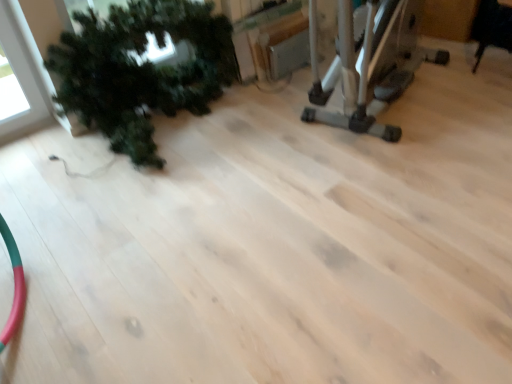
Question: Is black leather chair at upper right smaller than green matte plant at left?

Choices:
 (A) no
 (B) yes

Answer: (B)

Question: Is black leather chair at upper right at the left side of green matte plant at left?

Choices:
 (A) yes
 (B) no

Answer: (B)

Question: Does black leather chair at upper right have a lesser width compared to green matte plant at left?

Choices:
 (A) yes
 (B) no

Answer: (A)

Question: Considering the relative sizes of black leather chair at upper right and green matte plant at left in the image provided, is black leather chair at upper right shorter than green matte plant at left?

Choices:
 (A) yes
 (B) no

Answer: (A)

Question: From a real-world perspective, is black leather chair at upper right located higher than green matte plant at left?

Choices:
 (A) no
 (B) yes

Answer: (A)

Question: Do you think black leather chair at upper right is within green matte plant at left, or outside of it?

Choices:
 (A) inside
 (B) outside

Answer: (B)

Question: Visually, is black leather chair at upper right positioned to the left or to the right of green matte plant at left?

Choices:
 (A) left
 (B) right

Answer: (B)

Question: From a real-world perspective, is black leather chair at upper right physically located above or below green matte plant at left?

Choices:
 (A) above
 (B) below

Answer: (B)

Question: In terms of height, does black leather chair at upper right look taller or shorter compared to green matte plant at left?

Choices:
 (A) tall
 (B) short

Answer: (B)

Question: In terms of size, does green matte plant at left appear bigger or smaller than silver metallic elliptical trainer at upper right?

Choices:
 (A) big
 (B) small

Answer: (B)

Question: From the image's perspective, is green matte plant at left located above or below silver metallic elliptical trainer at upper right?

Choices:
 (A) below
 (B) above

Answer: (A)

Question: Is green matte plant at left wider or thinner than silver metallic elliptical trainer at upper right?

Choices:
 (A) thin
 (B) wide

Answer: (A)

Question: Considering the positions of point (170, 77) and point (345, 49), is point (170, 77) closer or farther from the camera than point (345, 49)?

Choices:
 (A) farther
 (B) closer

Answer: (A)

Question: Visually, is black leather chair at upper right positioned to the left or to the right of silver metallic elliptical trainer at upper right?

Choices:
 (A) left
 (B) right

Answer: (B)

Question: From the image's perspective, relative to silver metallic elliptical trainer at upper right, is black leather chair at upper right above or below?

Choices:
 (A) above
 (B) below

Answer: (A)